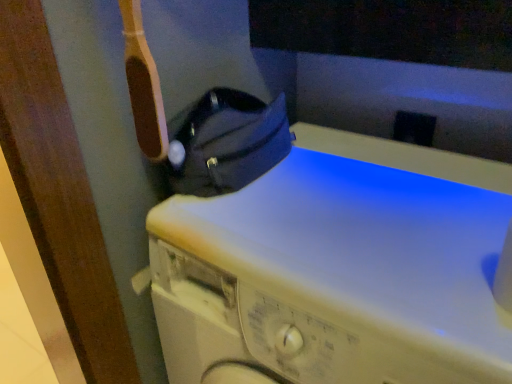
This screenshot has height=384, width=512. Find the location of `free spot to the right of black leather bag at upper left`. free spot to the right of black leather bag at upper left is located at coordinates (x=338, y=172).